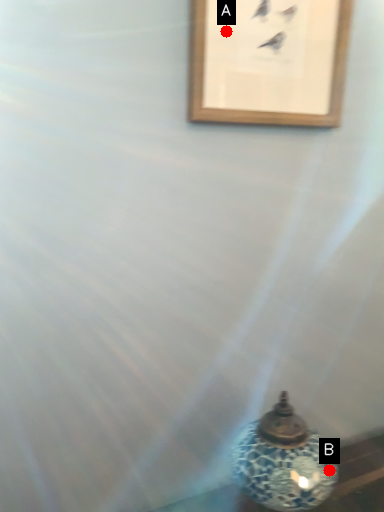
Question: Two points are circled on the image, labeled by A and B beside each circle. Which point is closer to the camera taking this photo?

Choices:
 (A) A is closer
 (B) B is closer

Answer: (B)